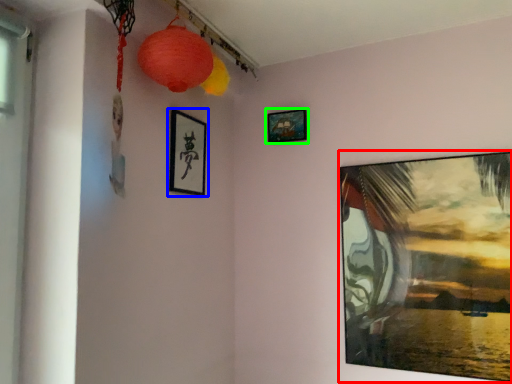
Question: Considering the real-world distances, which object is closest to picture frame (highlighted by a red box)? picture frame (highlighted by a blue box) or picture frame (highlighted by a green box).

Choices:
 (A) picture frame
 (B) picture frame

Answer: (B)